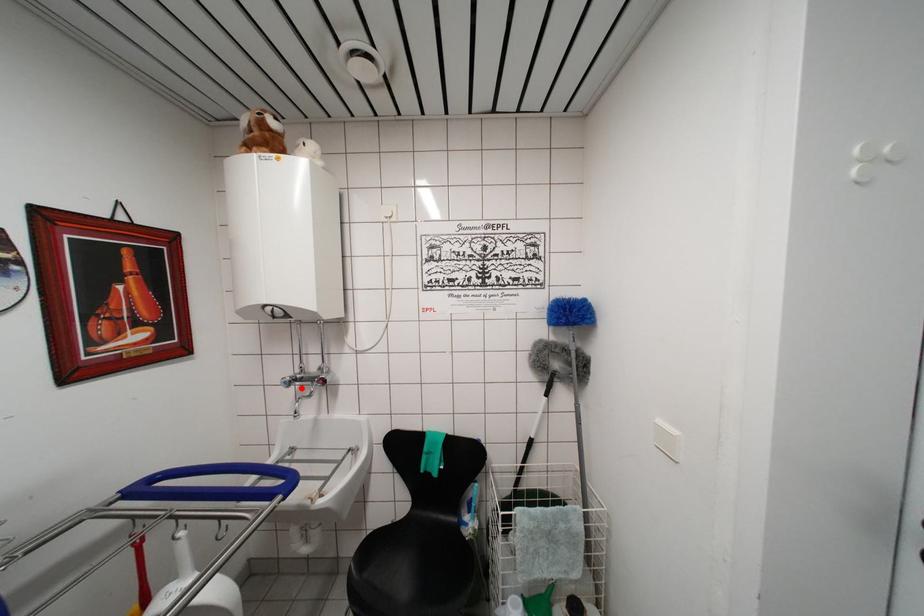
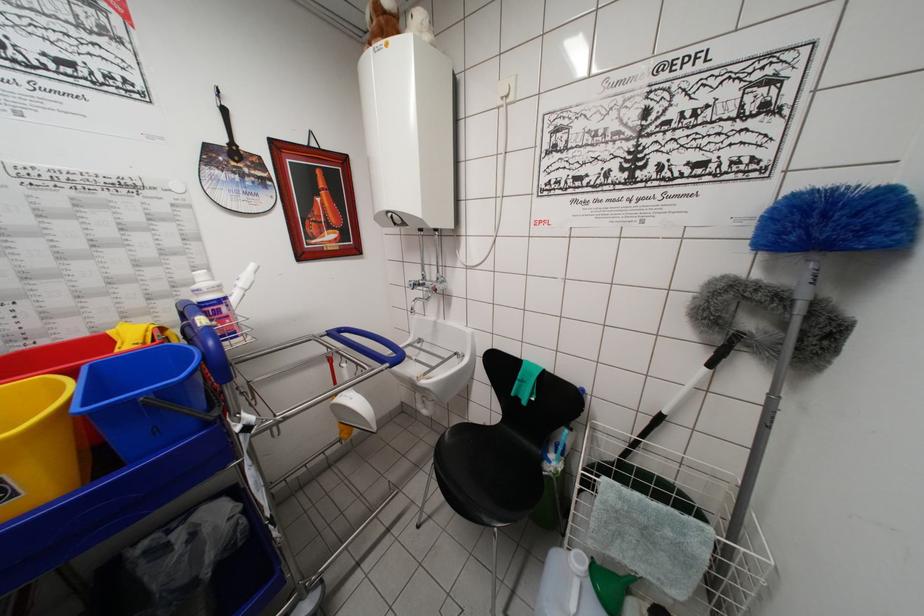
Where in the second image is the point corresponding to the highlighted location from the first image?

(428, 294)